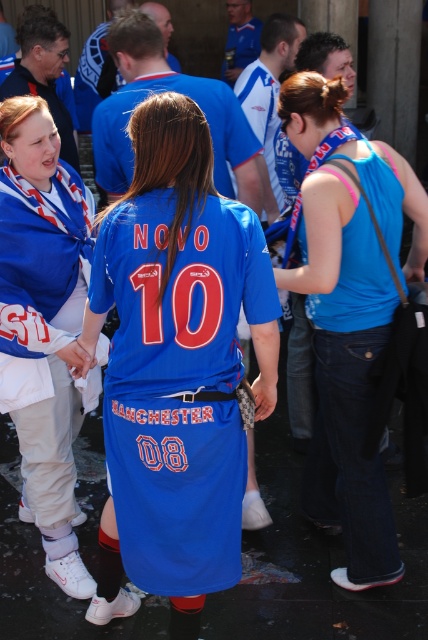
Question: Is blue jersey at center above matte blue jersey at center?

Choices:
 (A) no
 (B) yes

Answer: (A)

Question: Considering the real-world distances, which object is closest to the matte blue jersey at center?

Choices:
 (A) blue denim jeans at center
 (B) blue jersey at center

Answer: (B)

Question: Can you confirm if blue jersey at center is thinner than blue denim jeans at center?

Choices:
 (A) yes
 (B) no

Answer: (B)

Question: Can you confirm if blue denim jeans at center is positioned to the right of matte blue jersey at center?

Choices:
 (A) no
 (B) yes

Answer: (B)

Question: Which point is closer to the camera?

Choices:
 (A) (229, 547)
 (B) (44, 288)
 (C) (345, 182)

Answer: (A)

Question: Among these points, which one is nearest to the camera?

Choices:
 (A) (335, 404)
 (B) (6, 381)

Answer: (B)